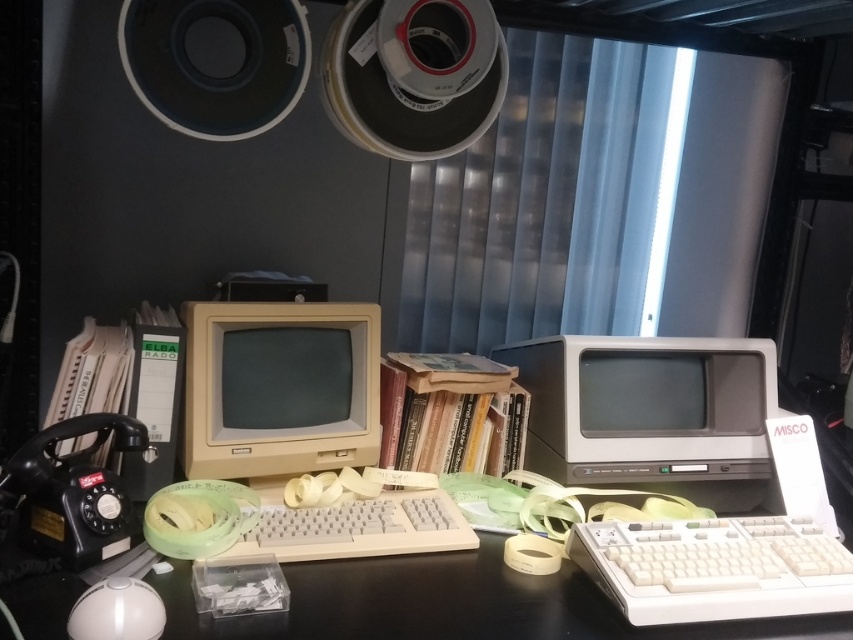
You are standing in front of the desk and want to reach both points on the desk. Which point, point [697,342] or point [819,540], is closer to you?

Point [697,342] is closer to you because it is further to the camera than point [819,540].